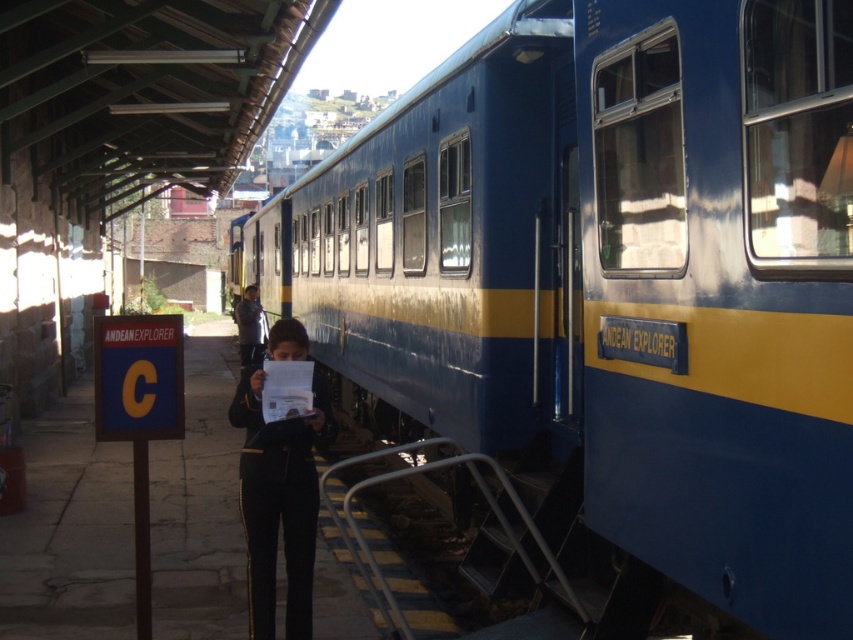
You are a passenger at the train station and need to locate the staff member in the dark blue uniform at center. Can you determine if the black fabric pants at center belong to the same staff member?

The black fabric pants at center is smaller than dark blue uniform at center, so they belong to the same staff member since the pants are part of the uniform.

You are a passenger at the train station and need to board the blue polished metal train at center. Where exactly should you go to board it?

The blue polished metal train at center is located at point (612, 292), so you should go to that coordinate to board it.